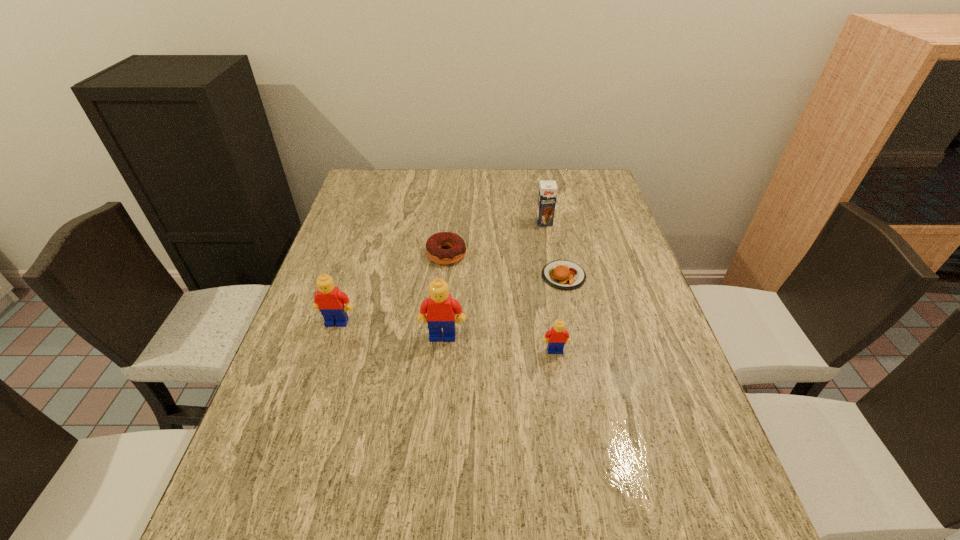
The image size is (960, 540). I want to click on free spot located 0.090m on the face of the fifth farthest object, so click(x=440, y=375).

Find the location of a particular element. Image resolution: width=960 pixels, height=540 pixels. vacant space located 0.180m on the face of the shortest Lego is located at coordinates (567, 427).

Locate an element on the screen. The image size is (960, 540). vacant space located on the front label of the farthest object is located at coordinates (550, 252).

What are the coordinates of `free space located 0.260m on the right of the fifth tallest object` in the screenshot? It's located at click(x=556, y=254).

This screenshot has height=540, width=960. Identify the location of vacant area located 0.390m on the front of the shortest object. point(595,426).

I want to click on object that is at the left edge, so click(x=329, y=300).

Where is `object that is positioned at the right edge`? This screenshot has width=960, height=540. object that is positioned at the right edge is located at coordinates (562, 274).

The image size is (960, 540). Find the location of `free spot at the far edge of the desktop`. free spot at the far edge of the desktop is located at coordinates point(496,173).

Locate an element on the screen. This screenshot has width=960, height=540. vacant region at the near edge of the desktop is located at coordinates (575, 464).

This screenshot has height=540, width=960. I want to click on vacant space at the left edge of the desktop, so click(358, 211).